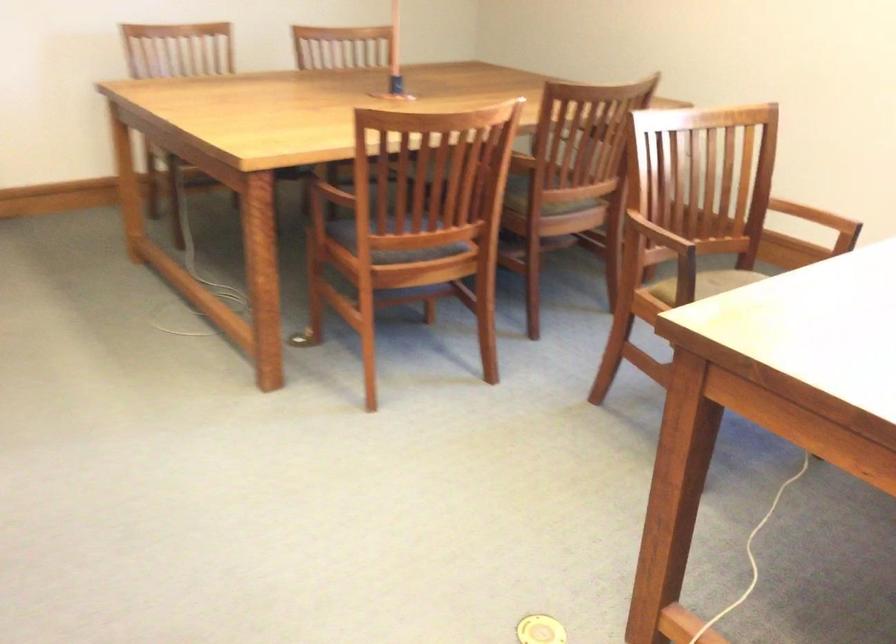
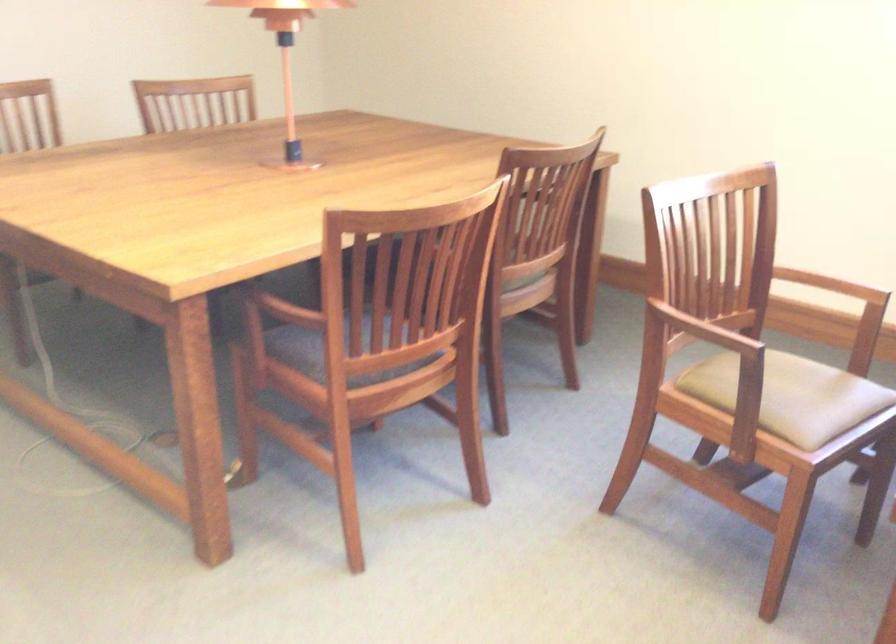
Locate, in the second image, the point that corresponds to (658,239) in the first image.

(712, 334)